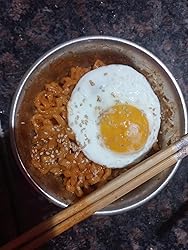
Image resolution: width=188 pixels, height=250 pixels. I want to click on chopstick, so click(88, 200), click(96, 205).